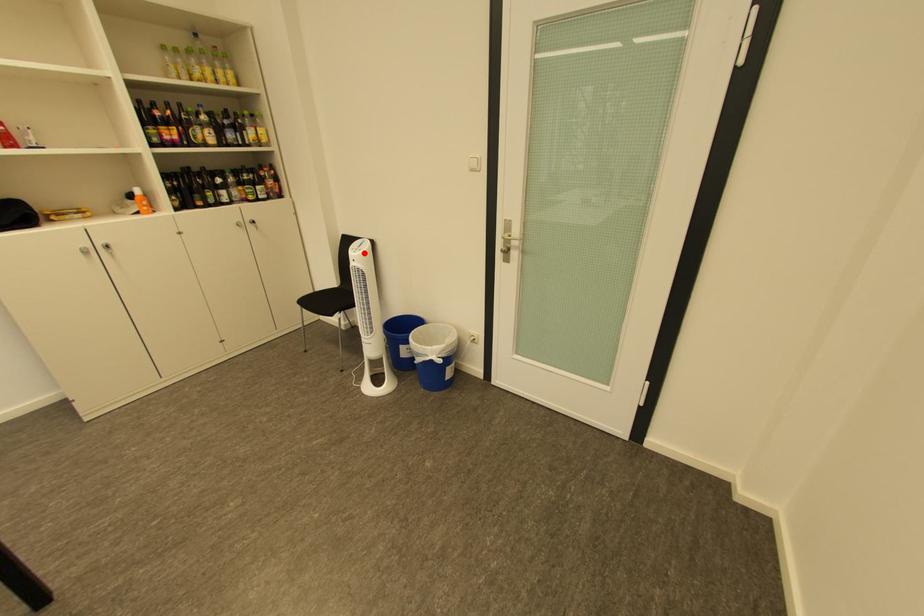
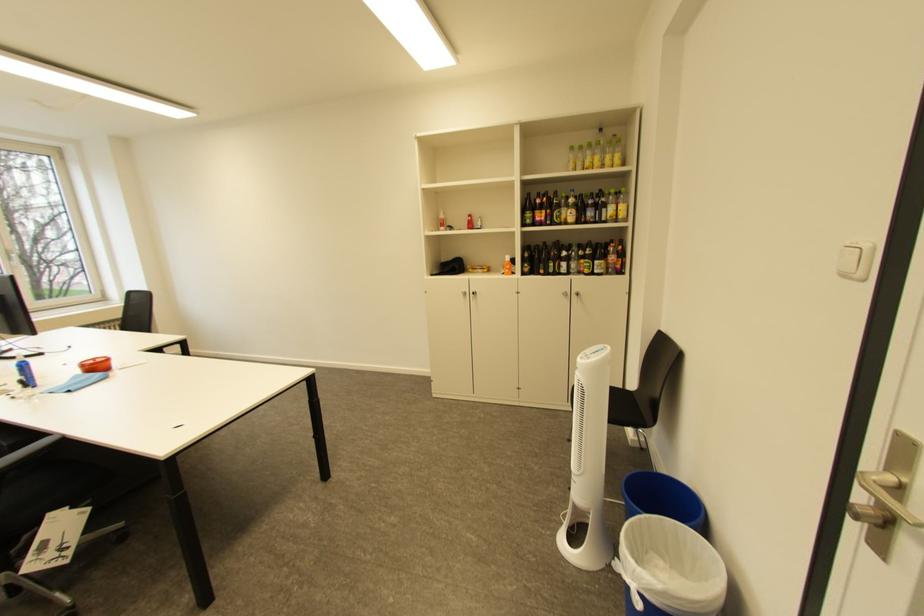
Find the pixel in the second image that matches the highlighted location in the first image.

(591, 359)